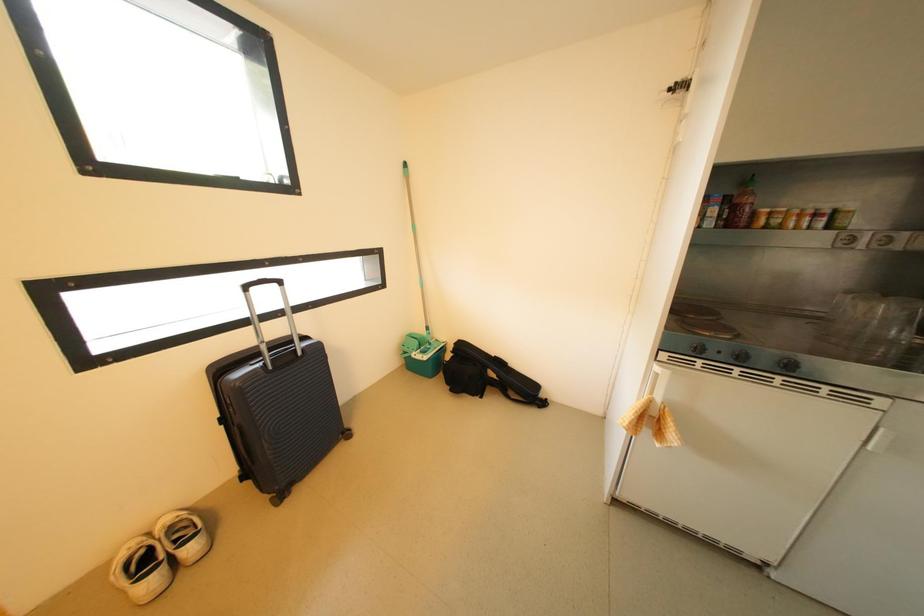
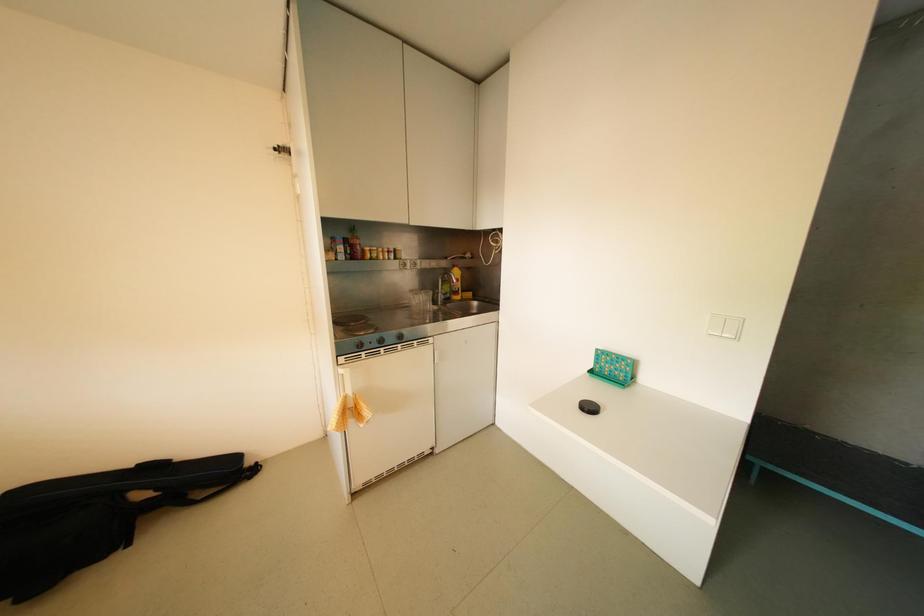
Question: The first image is from the beginning of the video and the second image is from the end. How did the camera likely rotate when shooting the video?

Choices:
 (A) Left
 (B) Right
 (C) Up
 (D) Down

Answer: (B)